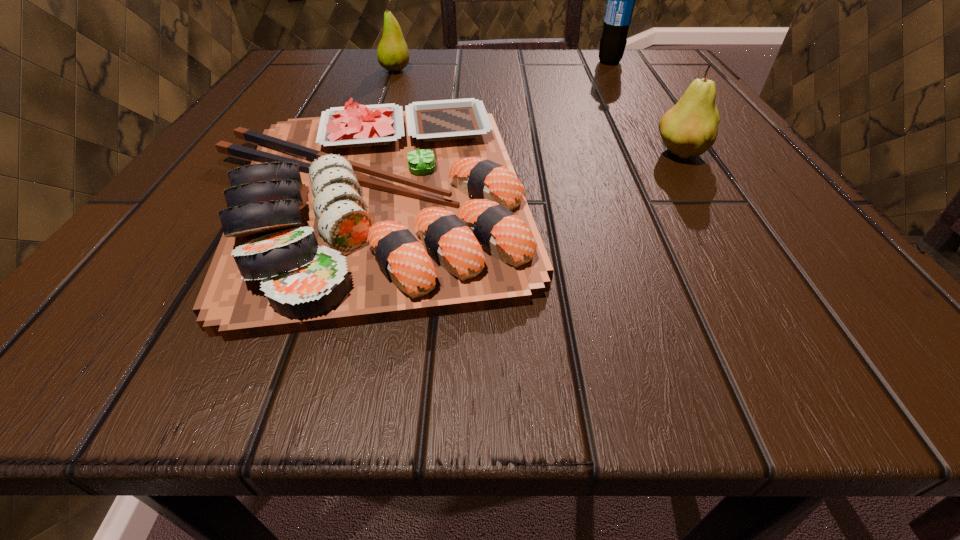
At what (x,y) coordinates should I click in order to perform the action: click on the tallest object. Please return your answer as a coordinate pair (x, y). This screenshot has width=960, height=540. Looking at the image, I should click on click(620, 0).

The image size is (960, 540). What are the coordinates of `the nearer pear` in the screenshot? It's located at (690, 127).

This screenshot has height=540, width=960. What are the coordinates of `the left pear` in the screenshot? It's located at (392, 53).

The width and height of the screenshot is (960, 540). I want to click on platter, so click(368, 214).

Where is `free location located 0.180m on the front of the tallest object`? The height and width of the screenshot is (540, 960). free location located 0.180m on the front of the tallest object is located at coordinates (636, 109).

Identify the location of vacant space located 0.230m on the front of the nearer pear. The width and height of the screenshot is (960, 540). (772, 299).

The width and height of the screenshot is (960, 540). I want to click on vacant region located on the front of the farther pear, so click(387, 93).

At what (x,y) coordinates should I click in order to perform the action: click on free location located on the right of the shortest object. Please return your answer as a coordinate pair (x, y). Looking at the image, I should click on (630, 197).

Identify the location of soda bottle that is at the far edge. This screenshot has height=540, width=960. (620, 0).

Locate an element on the screen. The height and width of the screenshot is (540, 960). pear that is at the far edge is located at coordinates (392, 53).